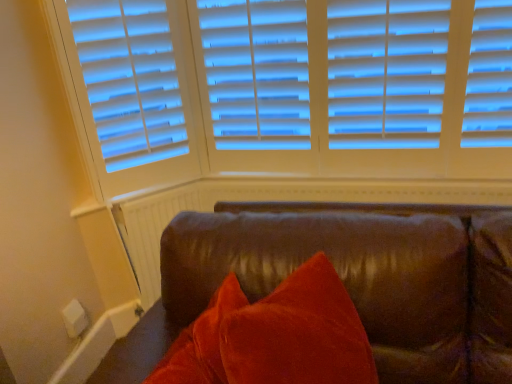
Question: Is white textured radiator at lower left in front of or behind brown leather couch at lower right in the image?

Choices:
 (A) front
 (B) behind

Answer: (B)

Question: Is point (182, 187) positioned closer to the camera than point (220, 205)?

Choices:
 (A) closer
 (B) farther

Answer: (B)

Question: Considering the positions of white textured radiator at lower left and brown leather couch at lower right in the image, is white textured radiator at lower left taller or shorter than brown leather couch at lower right?

Choices:
 (A) short
 (B) tall

Answer: (A)

Question: Is brown leather couch at lower right situated inside white textured radiator at lower left or outside?

Choices:
 (A) inside
 (B) outside

Answer: (B)

Question: In the image, is brown leather couch at lower right positioned in front of or behind white textured radiator at lower left?

Choices:
 (A) front
 (B) behind

Answer: (A)

Question: Is brown leather couch at lower right taller or shorter than white textured radiator at lower left?

Choices:
 (A) short
 (B) tall

Answer: (B)

Question: From a real-world perspective, is brown leather couch at lower right above or below white textured radiator at lower left?

Choices:
 (A) above
 (B) below

Answer: (B)